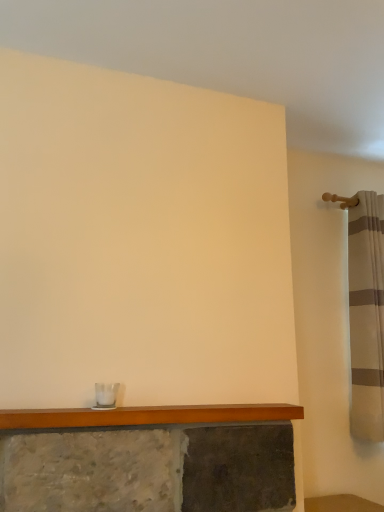
Question: In terms of width, does striped fabric shower curtain at right look wider or thinner when compared to wooden mantle at lower center?

Choices:
 (A) thin
 (B) wide

Answer: (B)

Question: Considering the positions of striped fabric shower curtain at right and wooden mantle at lower center in the image, is striped fabric shower curtain at right bigger or smaller than wooden mantle at lower center?

Choices:
 (A) small
 (B) big

Answer: (B)

Question: From the image's perspective, is striped fabric shower curtain at right located above or below wooden mantle at lower center?

Choices:
 (A) below
 (B) above

Answer: (B)

Question: Would you say wooden mantle at lower center is to the left or to the right of striped fabric shower curtain at right in the picture?

Choices:
 (A) left
 (B) right

Answer: (A)

Question: Is wooden mantle at lower center inside or outside of striped fabric shower curtain at right?

Choices:
 (A) inside
 (B) outside

Answer: (B)

Question: Is wooden mantle at lower center wider or thinner than striped fabric shower curtain at right?

Choices:
 (A) thin
 (B) wide

Answer: (A)

Question: Is wooden mantle at lower center taller or shorter than striped fabric shower curtain at right?

Choices:
 (A) short
 (B) tall

Answer: (A)